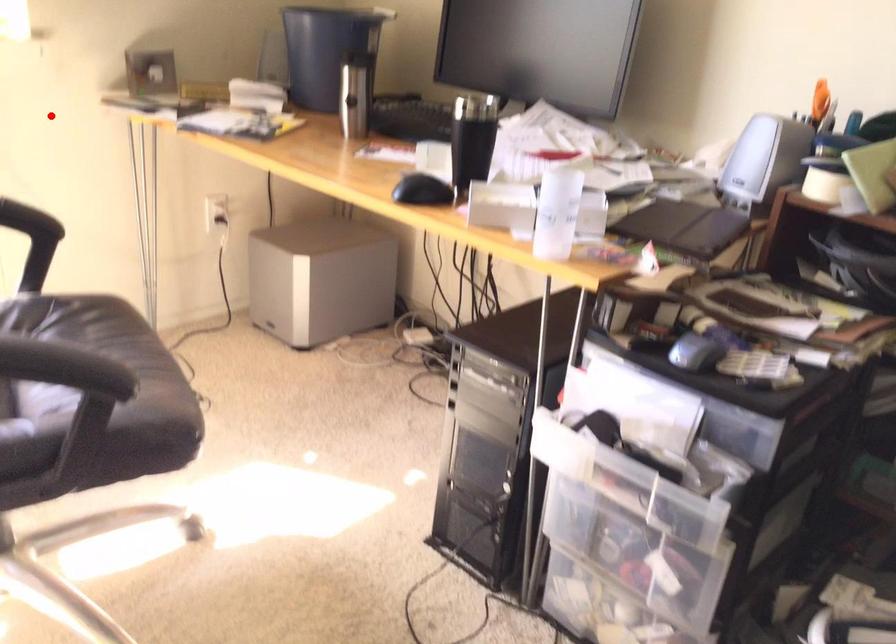
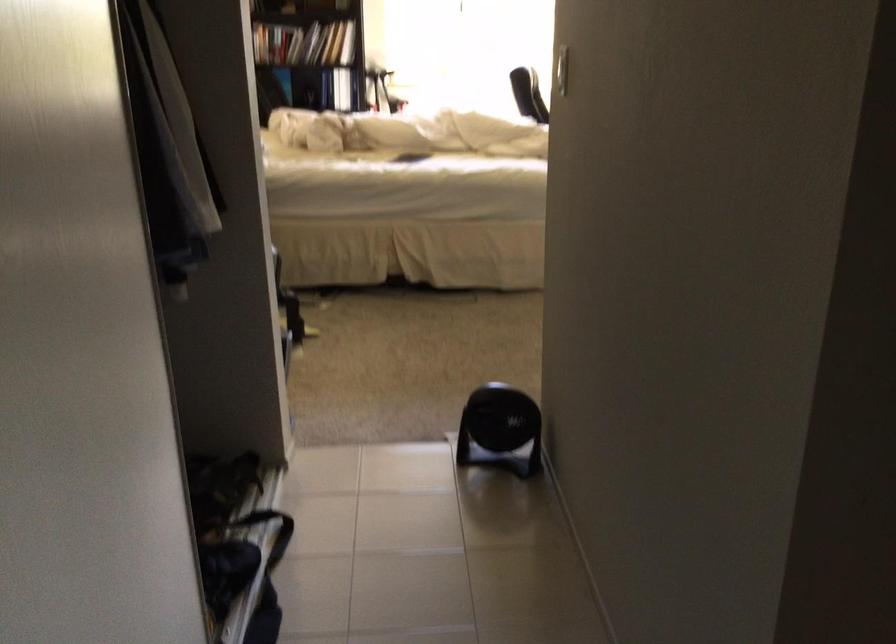
Question: I am providing you with two images of the same scene from different viewpoints. A red point is marked on the first image. Is the red point's position out of view in image 2?

Choices:
 (A) Yes
 (B) No

Answer: (A)